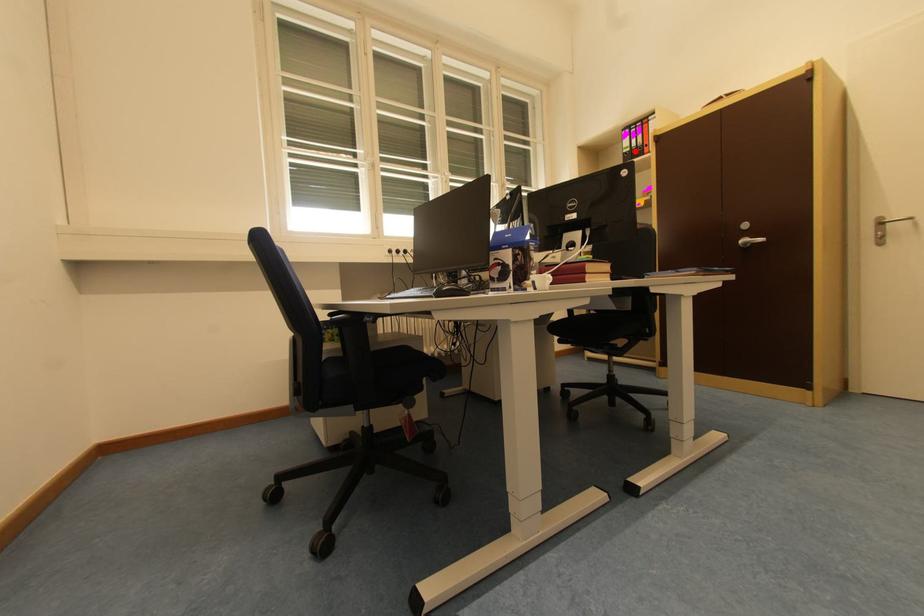
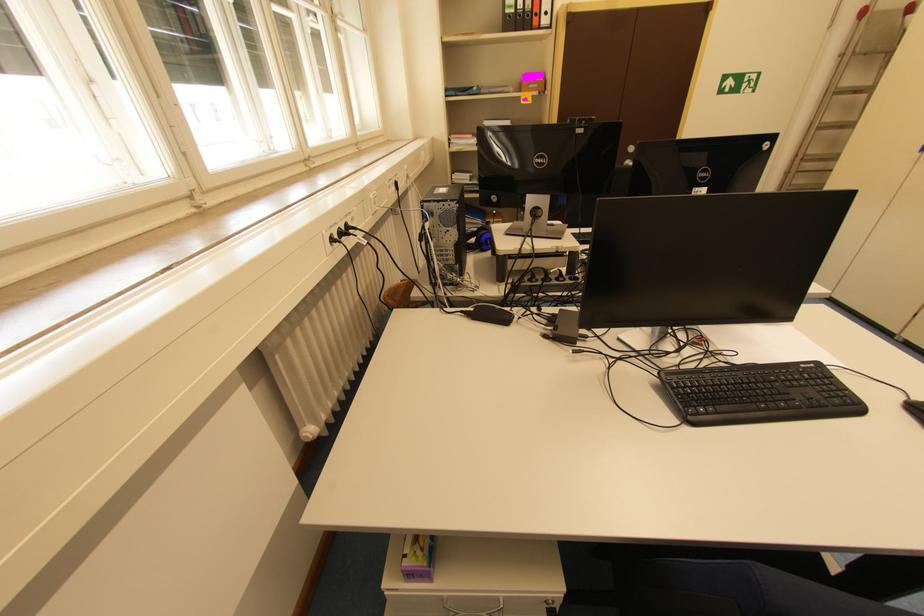
Question: I am providing you with two images of the same scene from different viewpoints. In image1, a red point is highlighted. Considering the same 3D point in image2, which of the following is correct?

Choices:
 (A) It is closer
 (B) It is farther

Answer: (B)